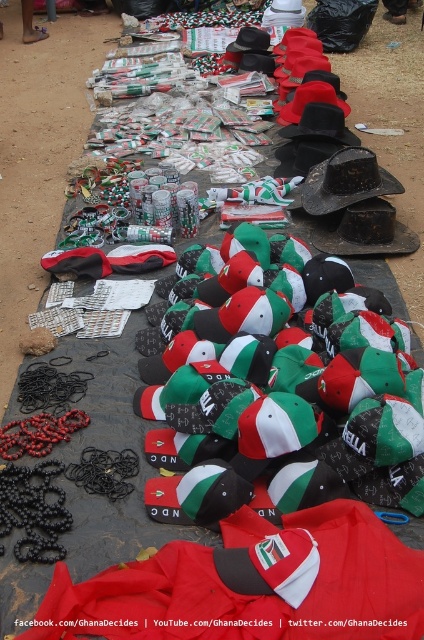
Looking at this image, can you confirm if red polyester blanket at lower center is smaller than matte black cowboy hat at center?

Yes.

Consider the image. Is red polyester blanket at lower center behind matte black cowboy hat at center?

No, it is in front of matte black cowboy hat at center.

Does point (354, 609) come behind point (315, 202)?

That is False.

Find the location of a particular element. The height and width of the screenshot is (640, 424). red polyester blanket at lower center is located at coordinates (251, 584).